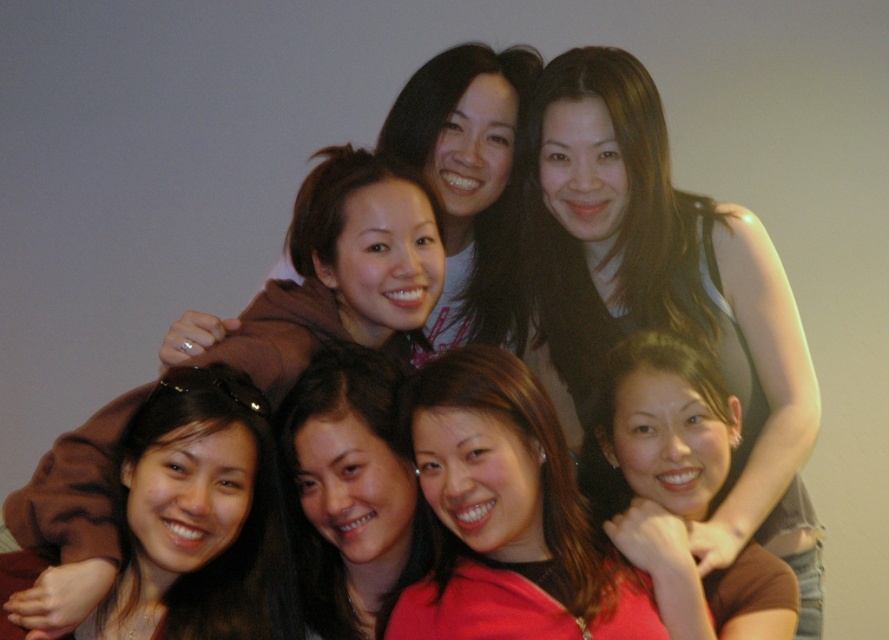
Question: Which object appears farthest from the camera in this image?

Choices:
 (A) smooth brown hair at center
 (B) matte red shirt at center

Answer: (A)

Question: Does matte black tank top at upper right appear over matte brown shirt at center?

Choices:
 (A) yes
 (B) no

Answer: (A)

Question: Can you confirm if matte black tank top at upper right is thinner than matte brown shirt at center?

Choices:
 (A) no
 (B) yes

Answer: (A)

Question: Is matte brown shirt at center to the right of smooth brown hair at center from the viewer's perspective?

Choices:
 (A) yes
 (B) no

Answer: (A)

Question: Which object appears closest to the camera in this image?

Choices:
 (A) smooth brown hair at center
 (B) matte brown shirt at center
 (C) matte black tank top at upper right

Answer: (B)

Question: Which object is positioned closest to the matte brown shirt at center?

Choices:
 (A) matte red shirt at center
 (B) smooth brown hair at center

Answer: (A)